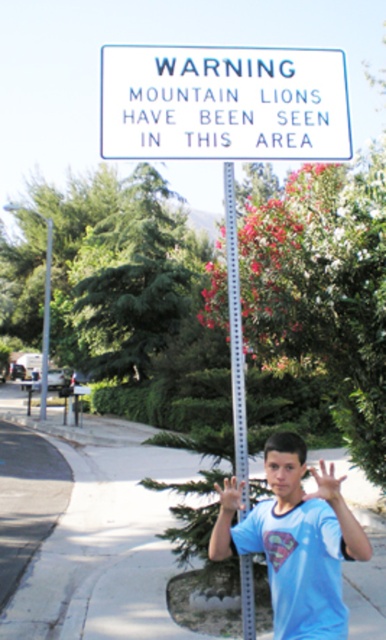
Question: Does paved concrete sidewalk at lower center lie behind light blue t-shirt at center?

Choices:
 (A) no
 (B) yes

Answer: (B)

Question: Can you confirm if light blue t-shirt at center is positioned to the left of metallic silver pole at center?

Choices:
 (A) no
 (B) yes

Answer: (A)

Question: Which point is farther to the camera?

Choices:
 (A) (240, 385)
 (B) (303, 570)

Answer: (A)

Question: Estimate the real-world distances between objects in this image. Which object is closer to the metallic silver pole at center?

Choices:
 (A) light blue t-shirt at center
 (B) white plastic sign at upper center
 (C) silver metallic pole at center
 (D) paved concrete sidewalk at lower center

Answer: (A)

Question: Is paved concrete sidewalk at lower center below white plastic sign at upper center?

Choices:
 (A) yes
 (B) no

Answer: (A)

Question: Which point appears closest to the camera in this image?

Choices:
 (A) (143, 102)
 (B) (242, 356)
 (C) (186, 476)
 (D) (47, 348)

Answer: (B)